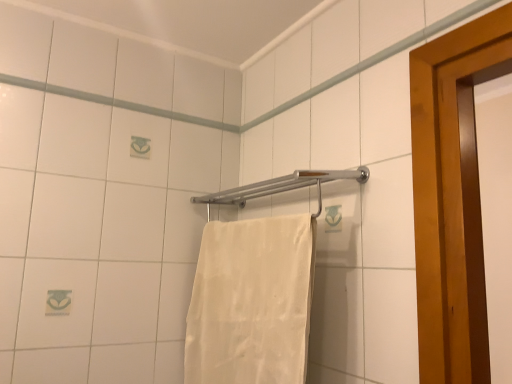
Question: Considering the positions of white cotton towel at center and silver metallic towel bar at center in the image, is white cotton towel at center wider or thinner than silver metallic towel bar at center?

Choices:
 (A) thin
 (B) wide

Answer: (A)

Question: Is white cotton towel at center taller or shorter than silver metallic towel bar at center?

Choices:
 (A) tall
 (B) short

Answer: (A)

Question: From a real-world perspective, is white cotton towel at center physically located above or below silver metallic towel bar at center?

Choices:
 (A) below
 (B) above

Answer: (A)

Question: In terms of height, does silver metallic towel bar at center look taller or shorter compared to white cotton towel at center?

Choices:
 (A) short
 (B) tall

Answer: (A)

Question: Considering the positions of point (280, 185) and point (294, 256), is point (280, 185) closer or farther from the camera than point (294, 256)?

Choices:
 (A) closer
 (B) farther

Answer: (B)

Question: Is silver metallic towel bar at center inside or outside of white cotton towel at center?

Choices:
 (A) outside
 (B) inside

Answer: (A)

Question: Would you say silver metallic towel bar at center is to the left or to the right of white cotton towel at center in the picture?

Choices:
 (A) right
 (B) left

Answer: (A)